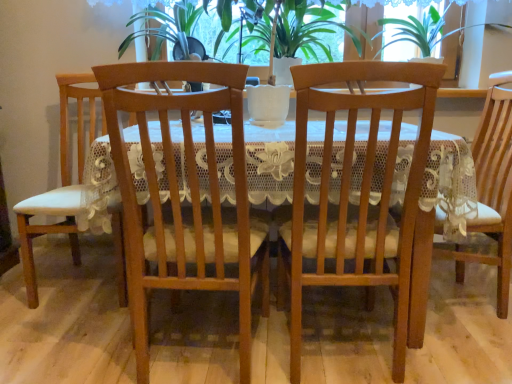
The image size is (512, 384). Find the location of `free space in front of white leather chair at left, the 4th chair in the right-to-left sequence`. free space in front of white leather chair at left, the 4th chair in the right-to-left sequence is located at coordinates (52, 329).